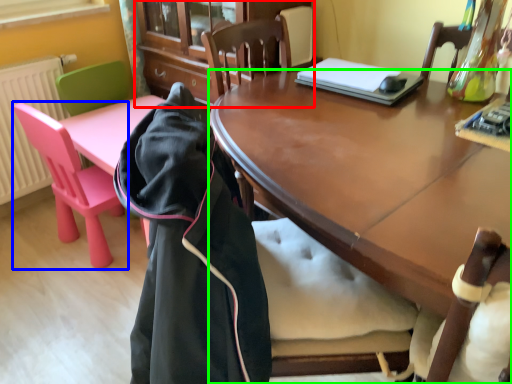
Question: Considering the real-world distances, which object is closest to cabinetry (highlighted by a red box)? chair (highlighted by a blue box) or desk (highlighted by a green box).

Choices:
 (A) chair
 (B) desk

Answer: (A)